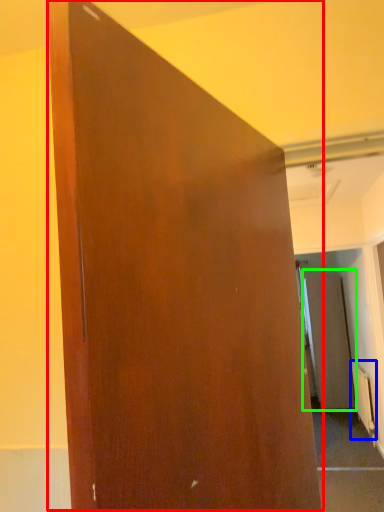
Question: Considering the real-world distances, which object is farthest from door (highlighted by a red box)? radiator (highlighted by a blue box) or screen door (highlighted by a green box)?

Choices:
 (A) radiator
 (B) screen door

Answer: (B)